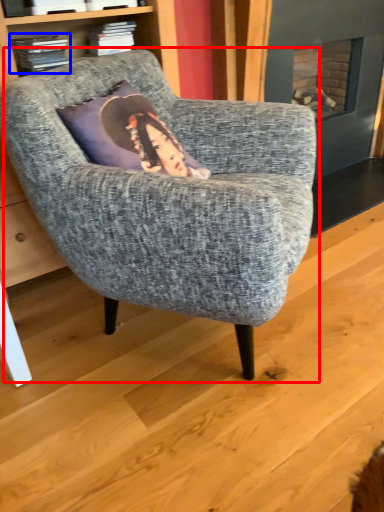
Question: Which object appears farthest to the camera in this image, chair (highlighted by a red box) or book (highlighted by a blue box)?

Choices:
 (A) chair
 (B) book

Answer: (B)